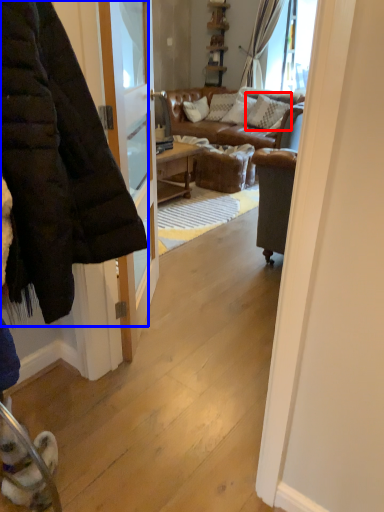
Question: Which point is further to the camera, pillow (highlighted by a red box) or jacket (highlighted by a blue box)?

Choices:
 (A) pillow
 (B) jacket

Answer: (A)